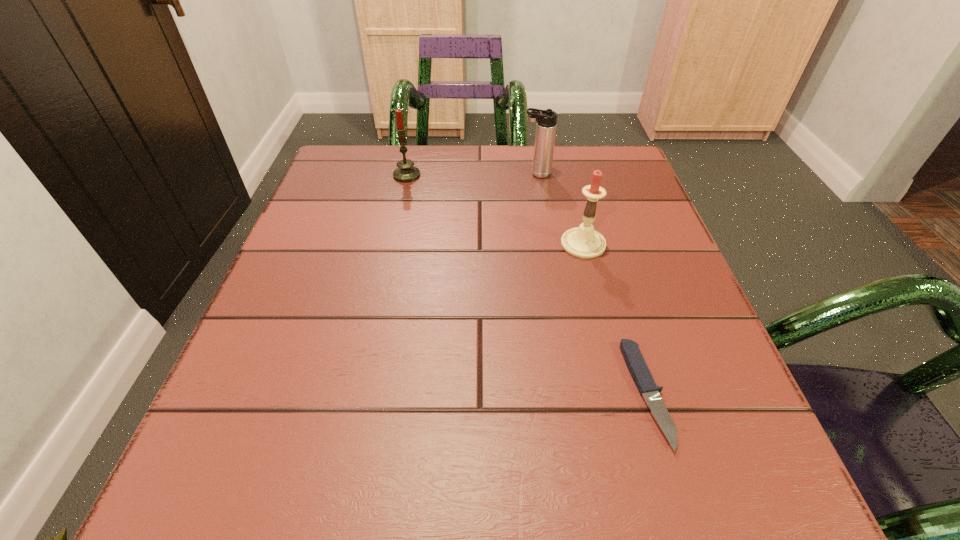
This screenshot has width=960, height=540. Identify the location of free spot at the near edge of the desktop. (609, 462).

At what (x,y) coordinates should I click in order to perform the action: click on free space at the left edge. Please return your answer as a coordinate pair (x, y). The width and height of the screenshot is (960, 540). Looking at the image, I should click on (297, 294).

Where is `vacant space at the right edge of the desktop`? vacant space at the right edge of the desktop is located at coordinates (684, 397).

Where is `free region at the far left corner`? Image resolution: width=960 pixels, height=540 pixels. free region at the far left corner is located at coordinates (328, 178).

Where is `vacant space at the far right corner`? This screenshot has width=960, height=540. vacant space at the far right corner is located at coordinates (644, 187).

In the image, there is a desktop. Where is `free space at the near right corner`? This screenshot has height=540, width=960. free space at the near right corner is located at coordinates (735, 484).

Locate an element on the screen. vacant space in between the steak knife and the nearer candle is located at coordinates (615, 319).

The width and height of the screenshot is (960, 540). In order to click on vacant space that is in between the thermos bottle and the nearest object in this screenshot , I will do `click(591, 284)`.

Locate an element on the screen. The width and height of the screenshot is (960, 540). free space between the thermos bottle and the left candle is located at coordinates (471, 174).

Locate an element on the screen. free space that is in between the thermos bottle and the nearer candle is located at coordinates (560, 209).